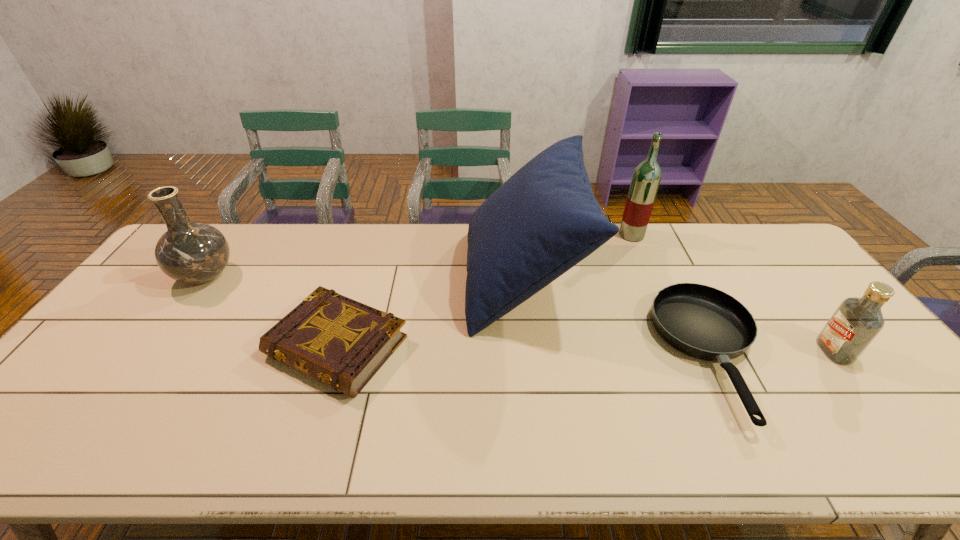
The height and width of the screenshot is (540, 960). In order to click on free location located 0.400m on the facing side of the cushion in this screenshot , I will do (340, 278).

Image resolution: width=960 pixels, height=540 pixels. Find the location of `vacant point located on the facing side of the cushion`. vacant point located on the facing side of the cushion is located at coordinates pos(355,278).

This screenshot has height=540, width=960. Identify the location of free space located 0.390m on the facing side of the cushion. (343, 278).

The image size is (960, 540). What are the coordinates of `free region located on the right of the fourth shortest object` in the screenshot? It's located at (271, 276).

The image size is (960, 540). What are the coordinates of `vacant space located 0.130m on the front-facing side of the rightmost object` in the screenshot? It's located at (772, 351).

Locate an element on the screen. The image size is (960, 540). free space located 0.130m on the front-facing side of the rightmost object is located at coordinates (772, 351).

Where is `free space located 0.060m on the front-facing side of the rightmost object`? free space located 0.060m on the front-facing side of the rightmost object is located at coordinates (799, 351).

The height and width of the screenshot is (540, 960). I want to click on free spot located 0.310m on the left of the hardback book, so click(x=152, y=347).

I want to click on liquor that is at the far edge, so click(646, 178).

In order to click on cushion that is at the far edge in this screenshot , I will do `click(541, 222)`.